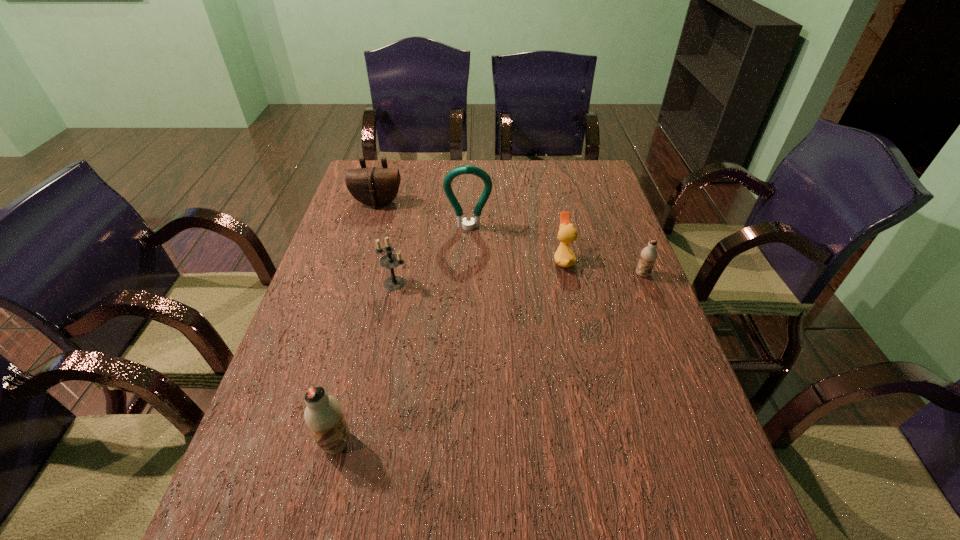
Find the location of a particular element. The height and width of the screenshot is (540, 960). object positioned at the right edge is located at coordinates (649, 254).

The width and height of the screenshot is (960, 540). I want to click on object positioned at the near left corner, so click(x=323, y=414).

What are the coordinates of `blank area at the far edge` in the screenshot? It's located at (531, 172).

Where is `blank space at the near edge`? blank space at the near edge is located at coordinates (354, 493).

The image size is (960, 540). In order to click on vacant space at the left edge of the desktop in this screenshot , I will do `click(300, 334)`.

The height and width of the screenshot is (540, 960). I want to click on vacant space at the right edge of the desktop, so click(x=586, y=197).

This screenshot has width=960, height=540. Identify the location of vacant space at the near left corner of the desktop. (292, 452).

I want to click on vacant space at the far right corner, so click(x=563, y=181).

Where is `free space between the nearer chocolate milk and the candle holder`? The width and height of the screenshot is (960, 540). free space between the nearer chocolate milk and the candle holder is located at coordinates (365, 363).

Find the location of a particular element. This screenshot has height=540, width=960. vacant space in between the nearer chocolate milk and the pouch is located at coordinates point(357,323).